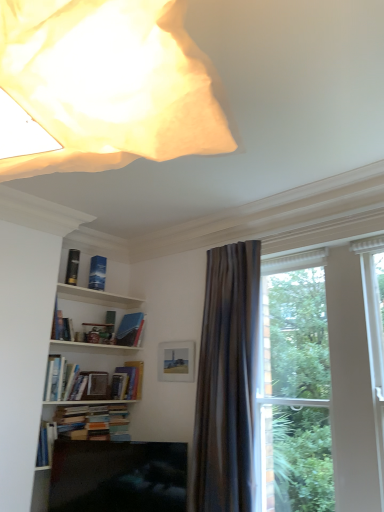
Question: Is hardcover book at center, the 4th book viewed from the top, facing away from metallic gold bookshelf at upper left, which is counted as the 1th book, starting from the top?

Choices:
 (A) yes
 (B) no

Answer: (B)

Question: Does hardcover book at center, which appears as the second book when ordered from the bottom, lie behind metallic gold bookshelf at upper left, positioned as the fifth book in bottom-to-top order?

Choices:
 (A) no
 (B) yes

Answer: (A)

Question: From a real-world perspective, is hardcover book at center, which appears as the second book when ordered from the bottom, positioned over metallic gold bookshelf at upper left, which is counted as the 1th book, starting from the top, based on gravity?

Choices:
 (A) yes
 (B) no

Answer: (B)

Question: From the image's perspective, is hardcover book at center, which appears as the second book when ordered from the bottom, located beneath metallic gold bookshelf at upper left, positioned as the fifth book in bottom-to-top order?

Choices:
 (A) no
 (B) yes

Answer: (B)

Question: Is hardcover book at center, the 4th book viewed from the top, placed right next to metallic gold bookshelf at upper left, positioned as the fifth book in bottom-to-top order?

Choices:
 (A) no
 (B) yes

Answer: (A)

Question: Is hardcover book at center, which appears as the second book when ordered from the bottom, bigger or smaller than silky gray curtain at right?

Choices:
 (A) small
 (B) big

Answer: (A)

Question: Considering the positions of point (94, 374) and point (248, 485), is point (94, 374) closer or farther from the camera than point (248, 485)?

Choices:
 (A) farther
 (B) closer

Answer: (A)

Question: In the image, is hardcover book at center, the 4th book viewed from the top, on the left side or the right side of silky gray curtain at right?

Choices:
 (A) right
 (B) left

Answer: (B)

Question: From the image's perspective, is hardcover book at center, the 4th book viewed from the top, located above or below silky gray curtain at right?

Choices:
 (A) below
 (B) above

Answer: (A)

Question: Considering the positions of point (132, 306) and point (69, 250), is point (132, 306) closer or farther from the camera than point (69, 250)?

Choices:
 (A) farther
 (B) closer

Answer: (A)

Question: Considering the positions of white wooden shelf at upper left and metallic gold bookshelf at upper left, positioned as the fifth book in bottom-to-top order, in the image, is white wooden shelf at upper left wider or thinner than metallic gold bookshelf at upper left, positioned as the fifth book in bottom-to-top order,?

Choices:
 (A) wide
 (B) thin

Answer: (A)

Question: Would you say white wooden shelf at upper left is to the left or to the right of metallic gold bookshelf at upper left, which is counted as the 1th book, starting from the top, in the picture?

Choices:
 (A) left
 (B) right

Answer: (B)

Question: From the image's perspective, is white wooden shelf at upper left located above or below metallic gold bookshelf at upper left, which is counted as the 1th book, starting from the top?

Choices:
 (A) above
 (B) below

Answer: (B)

Question: Is metallic gold bookshelf at upper left, which is counted as the 1th book, starting from the top, taller or shorter than blue matte book at upper center, the 3th book in the bottom-to-top sequence?

Choices:
 (A) tall
 (B) short

Answer: (B)

Question: Looking at their shapes, would you say metallic gold bookshelf at upper left, positioned as the fifth book in bottom-to-top order, is wider or thinner than blue matte book at upper center, the 3th book in the bottom-to-top sequence?

Choices:
 (A) wide
 (B) thin

Answer: (B)